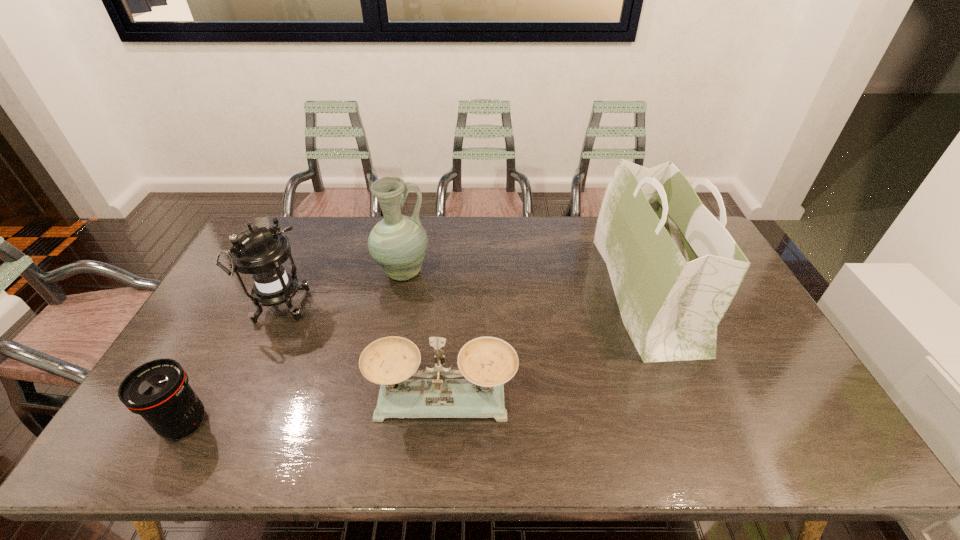
I want to click on grocery bag, so click(675, 269).

The width and height of the screenshot is (960, 540). In order to click on pitcher in this screenshot , I will do `click(398, 243)`.

Locate an element on the screen. The image size is (960, 540). lantern is located at coordinates (260, 252).

Locate an element on the screen. This screenshot has height=540, width=960. scale is located at coordinates (487, 363).

Image resolution: width=960 pixels, height=540 pixels. Identify the location of the shortest object. (158, 390).

The image size is (960, 540). What are the coordinates of `vacant space located on the left of the rightmost object` in the screenshot? It's located at (497, 292).

You are a GUI agent. You are given a task and a screenshot of the screen. Output one action in this format:
    pyautogui.click(x=<x>, y=<y>)
    Task: Click on the vacant position located on the handle side of the pitcher
    The width and height of the screenshot is (960, 540).
    Given the screenshot: What is the action you would take?
    pyautogui.click(x=503, y=273)

I want to click on vacant position located 0.090m on the back of the lantern, so click(x=298, y=269).

The width and height of the screenshot is (960, 540). In order to click on vacant space located on the right of the shortest object in this screenshot , I will do `click(254, 423)`.

Find the location of `grocery bag present at the far edge`. grocery bag present at the far edge is located at coordinates (675, 269).